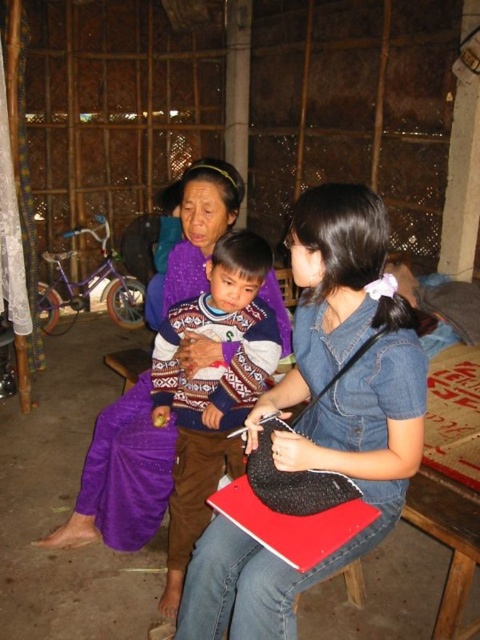
Is knitted sweater at center further to the viewer compared to purple woven fabric at center?

No, knitted sweater at center is closer to the viewer.

Is point (191, 484) more distant than point (192, 188)?

Yes, it is behind point (192, 188).

Locate an element on the screen. This screenshot has height=640, width=480. knitted sweater at center is located at coordinates (212, 388).

Measure the distance between denim blue shirt at center and knitted sweater at center.

17.80 inches

You are a GUI agent. You are given a task and a screenshot of the screen. Output one action in this format:
    pyautogui.click(x=<x>, y=<y>)
    Task: Click on the denim blue shirt at center
    
    Given the screenshot: What is the action you would take?
    tap(323, 413)

Between denim blue shirt at center and purple woven fabric at center, which one appears on the right side from the viewer's perspective?

Positioned to the right is denim blue shirt at center.

Who is positioned more to the left, denim blue shirt at center or purple woven fabric at center?

purple woven fabric at center is more to the left.

Identify the location of denim blue shirt at center. click(x=323, y=413).